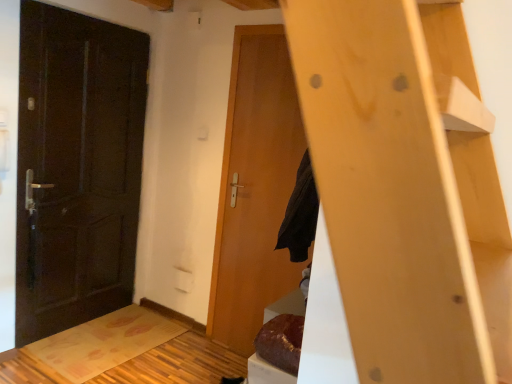
Question: Can you confirm if wooden door at center, which is counted as the 1th door, starting from the right, is thinner than matte dark brown door at left, acting as the 2th door starting from the right?

Choices:
 (A) yes
 (B) no

Answer: (A)

Question: Is wooden door at center, which is counted as the 1th door, starting from the right, bigger than matte dark brown door at left, acting as the 2th door starting from the right?

Choices:
 (A) no
 (B) yes

Answer: (A)

Question: Is wooden door at center, which is counted as the 1th door, starting from the right, looking in the opposite direction of matte dark brown door at left, which is the 1th door in left-to-right order?

Choices:
 (A) yes
 (B) no

Answer: (B)

Question: From the image's perspective, would you say wooden door at center, which appears as the 2th door when viewed from the left, is shown under matte dark brown door at left, which is the 1th door in left-to-right order?

Choices:
 (A) yes
 (B) no

Answer: (A)

Question: From a real-world perspective, is wooden door at center, which is counted as the 1th door, starting from the right, located higher than matte dark brown door at left, acting as the 2th door starting from the right?

Choices:
 (A) no
 (B) yes

Answer: (A)

Question: Could you tell me if wooden door at center, which is counted as the 1th door, starting from the right, is facing matte dark brown door at left, acting as the 2th door starting from the right?

Choices:
 (A) yes
 (B) no

Answer: (B)

Question: From a real-world perspective, does matte dark brown door at left, acting as the 2th door starting from the right, stand above wooden door at center, which appears as the 2th door when viewed from the left?

Choices:
 (A) yes
 (B) no

Answer: (A)

Question: Considering the relative sizes of matte dark brown door at left, which is the 1th door in left-to-right order, and wooden door at center, which is counted as the 1th door, starting from the right, in the image provided, is matte dark brown door at left, which is the 1th door in left-to-right order, smaller than wooden door at center, which is counted as the 1th door, starting from the right,?

Choices:
 (A) yes
 (B) no

Answer: (B)

Question: Does matte dark brown door at left, acting as the 2th door starting from the right, have a lesser height compared to wooden door at center, which is counted as the 1th door, starting from the right?

Choices:
 (A) no
 (B) yes

Answer: (B)

Question: Can you confirm if matte dark brown door at left, which is the 1th door in left-to-right order, is wider than wooden door at center, which appears as the 2th door when viewed from the left?

Choices:
 (A) no
 (B) yes

Answer: (B)

Question: Is matte dark brown door at left, which is the 1th door in left-to-right order, positioned before wooden door at center, which appears as the 2th door when viewed from the left?

Choices:
 (A) no
 (B) yes

Answer: (B)

Question: Can you confirm if matte dark brown door at left, acting as the 2th door starting from the right, is bigger than wooden door at center, which appears as the 2th door when viewed from the left?

Choices:
 (A) no
 (B) yes

Answer: (B)

Question: Looking at the image, does matte dark brown door at left, which is the 1th door in left-to-right order, seem bigger or smaller compared to wooden door at center, which appears as the 2th door when viewed from the left?

Choices:
 (A) small
 (B) big

Answer: (B)